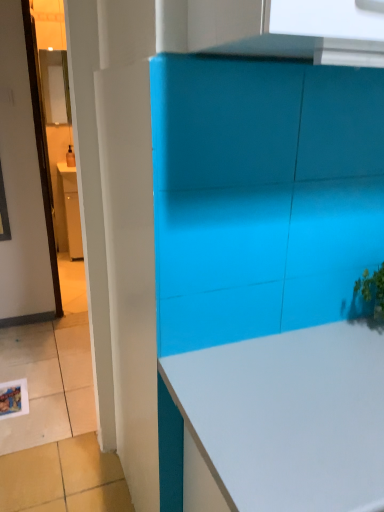
This screenshot has height=512, width=384. Describe the element at coordinates (287, 418) in the screenshot. I see `white glossy countertop at lower right` at that location.

At what (x,y) coordinates should I click in order to perform the action: click on white glossy countertop at lower right. Please return your answer as a coordinate pair (x, y). This screenshot has height=512, width=384. Looking at the image, I should click on (287, 418).

At what (x,y) coordinates should I click in order to perform the action: click on white glossy countertop at lower right. Please return your answer as a coordinate pair (x, y). This screenshot has width=384, height=512. Looking at the image, I should click on [287, 418].